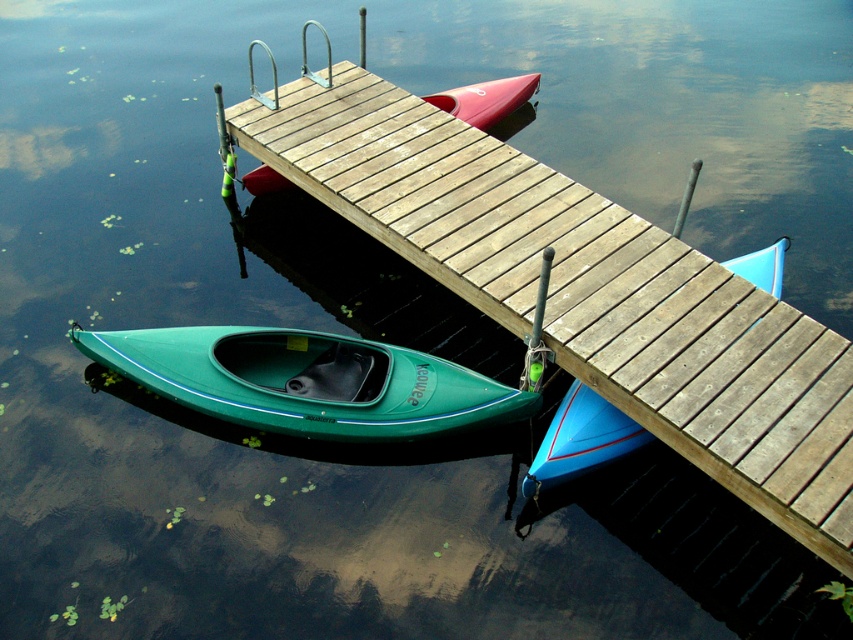
You are planning to store a new canoe in the lakeside area. The blue matte canoe at center and the matte red canoe at center are already there. Which canoe has a narrower width?

The blue matte canoe at center is thinner than the matte red canoe at center, so it has a narrower width.

Consider the image. You are standing on the wooden dock and want to choose the kayak that is closer to you. Which one should you pick between the blue matte canoe at center and the matte red canoe at center?

The blue matte canoe at center is closer to the viewer than the matte red canoe at center, so you should pick the blue matte canoe at center.

You are planning to launch a small boat from the dock. You see a blue matte canoe at center and a matte red canoe at center. Which canoe is closer to the right side of the dock?

The blue matte canoe at center is positioned on the right side of the matte red canoe at center, so it is closer to the right side of the dock.